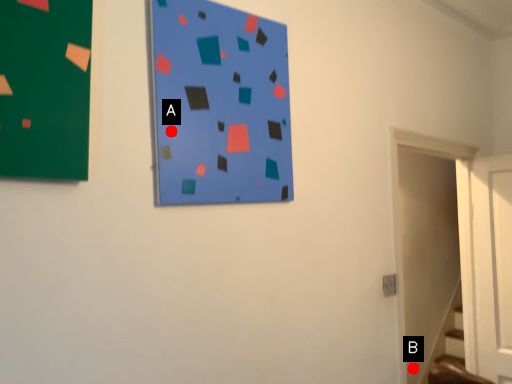
Question: Two points are circled on the image, labeled by A and B beside each circle. Among these points, which one is farthest from the camera?

Choices:
 (A) A is further
 (B) B is further

Answer: (B)